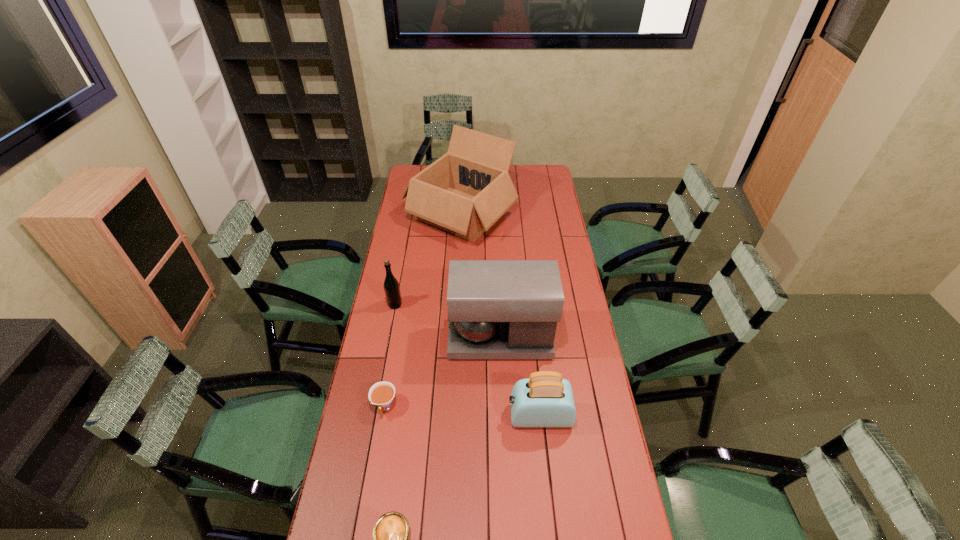
You are a GUI agent. You are given a task and a screenshot of the screen. Output one action in this format:
    pyautogui.click(x=<x>, y=<y>)
    Task: Click on the blank space located 0.130m on the side of the toaster with the lever
    
    Given the screenshot: What is the action you would take?
    pyautogui.click(x=470, y=416)

Find the location of a particular element. The image size is (960, 540). free space located on the side of the toaster with the lever is located at coordinates (396, 416).

This screenshot has width=960, height=540. I want to click on vacant space situated 0.310m on the side of the toaster with the lever, so click(419, 416).

Where is `vacant space located 0.280m on the side of the shortest object with the handle`? vacant space located 0.280m on the side of the shortest object with the handle is located at coordinates (368, 507).

The height and width of the screenshot is (540, 960). Identify the location of object that is positioned at the far edge. (464, 192).

This screenshot has height=540, width=960. What are the coordinates of `box located in the left edge section of the desktop` in the screenshot? It's located at (464, 192).

Find the location of a particular element. The width and height of the screenshot is (960, 540). beer bottle present at the left edge is located at coordinates (391, 286).

Locate an element on the screen. This screenshot has height=540, width=960. teacup located in the left edge section of the desktop is located at coordinates (381, 394).

Locate an element on the screen. This screenshot has width=960, height=540. coffee maker located at the right edge is located at coordinates (497, 309).

You are a GUI agent. You are given a task and a screenshot of the screen. Output one action in this format:
    pyautogui.click(x=<x>, y=<y>)
    Task: Click on the toaster positioned at the right edge
    
    Given the screenshot: What is the action you would take?
    545,399